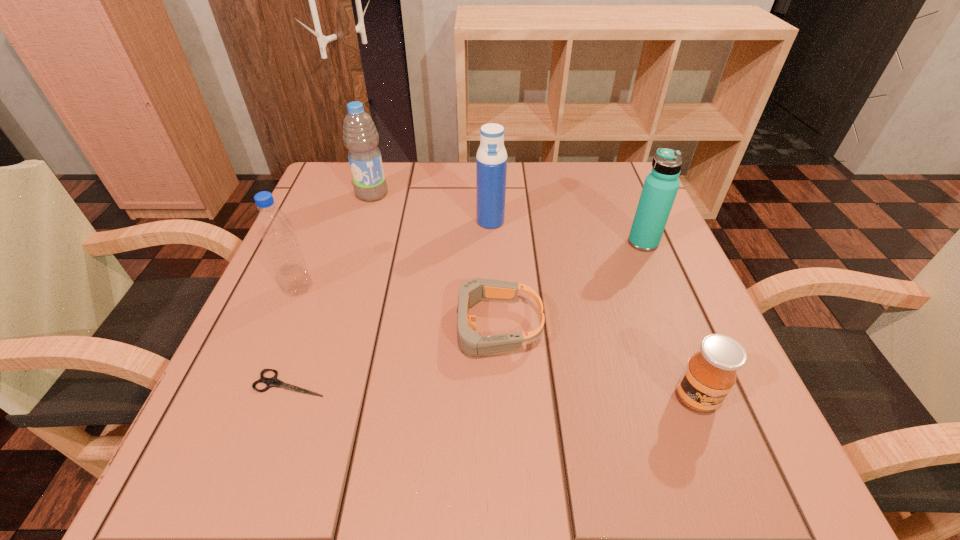
You are a GUI agent. You are given a task and a screenshot of the screen. Output one action in this format:
    pyautogui.click(x=<x>, y=<y>)
    Task: Click on the water bottle at the right edge
    This screenshot has width=960, height=540.
    Given the screenshot: What is the action you would take?
    pyautogui.click(x=660, y=188)

Find the location of a particular element. The height and width of the screenshot is (540, 960). honey situated at the right edge is located at coordinates (710, 374).

Identify the location of object that is positioned at the far left corner. This screenshot has width=960, height=540. (361, 138).

In the image, there is a desktop. Where is `free space at the far edge`? The height and width of the screenshot is (540, 960). free space at the far edge is located at coordinates (436, 192).

The height and width of the screenshot is (540, 960). What are the coordinates of `free space at the near edge` in the screenshot? It's located at (372, 474).

Find the location of a particular element. free space at the left edge of the desktop is located at coordinates (331, 248).

Find the location of a particular element. Image resolution: width=960 pixels, height=540 pixels. free space at the right edge is located at coordinates (662, 245).

Identify the location of vacant region at the near left corner of the desktop. Image resolution: width=960 pixels, height=540 pixels. (212, 452).

At what (x,y) coordinates should I click in order to perform the action: click on free space at the far right corner of the desktop. Please return your answer as a coordinate pair (x, y). Image resolution: width=960 pixels, height=540 pixels. Looking at the image, I should click on (602, 163).

You are a GUI agent. You are given a task and a screenshot of the screen. Output one action in this format:
    pyautogui.click(x=<x>, y=<y>)
    Task: Click on the free spot between the goggles and the shortest object
    Image resolution: width=960 pixels, height=540 pixels.
    Given the screenshot: What is the action you would take?
    point(392,354)